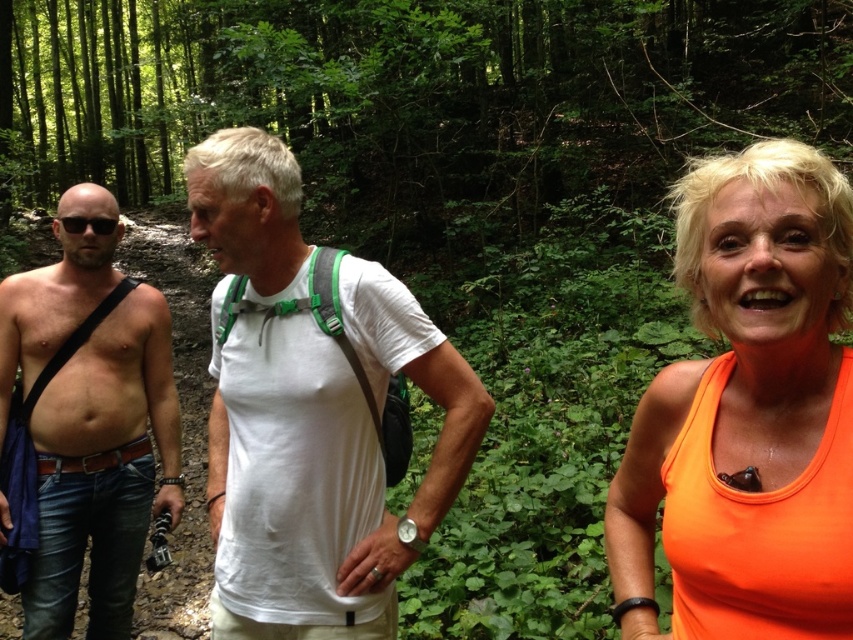
Does orange fabric tank top at center have a larger size compared to white matte t-shirt at center?

No.

The height and width of the screenshot is (640, 853). In order to click on orange fabric tank top at center in this screenshot , I will do `click(747, 412)`.

This screenshot has width=853, height=640. I want to click on orange fabric tank top at center, so click(747, 412).

Consider the image. Who is more distant from viewer, (755, 248) or (84, 417)?

Point (84, 417)

Does orange fabric tank top at center appear over bare skin at left?

Yes.

The height and width of the screenshot is (640, 853). What do you see at coordinates (747, 412) in the screenshot? I see `orange fabric tank top at center` at bounding box center [747, 412].

Where is `orange fabric tank top at center`? This screenshot has height=640, width=853. orange fabric tank top at center is located at coordinates (747, 412).

Can you confirm if white matte t-shirt at center is bigger than bare skin at left?

Yes.

Is white matte t-shirt at center to the right of bare skin at left from the viewer's perspective?

Indeed, white matte t-shirt at center is positioned on the right side of bare skin at left.

Is point (463, 372) positioned before point (119, 557)?

Yes, it is.

The width and height of the screenshot is (853, 640). What are the coordinates of `white matte t-shirt at center` in the screenshot? It's located at (309, 410).